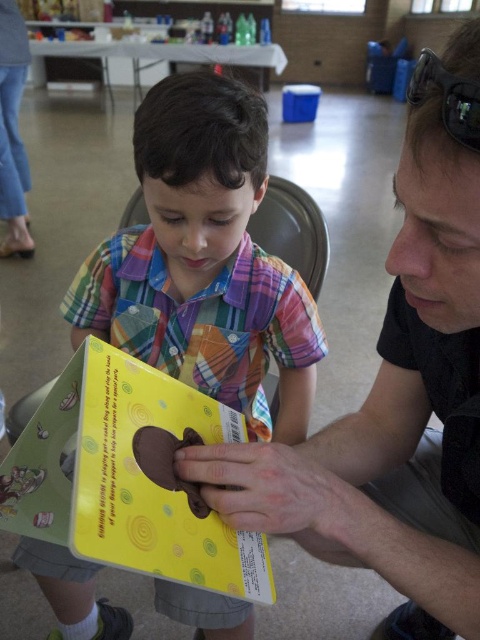
You are a child who wants to reach the yellow matte book at center and the black plastic goggles at upper right. Which object is taller?

The yellow matte book at center is taller than the black plastic goggles at upper right.

You are a delivery robot that needs to place a small package between the yellow matte book at center and the black plastic goggles at upper right. The package is 16 inches long. Can it fit in the space between them?

The distance between the yellow matte book at center and the black plastic goggles at upper right is 17.48 inches. Since the package is 16 inches long, it can fit in the space between them as there is enough room.

Looking at the scene where a child and an adult are interacting with books, which book is positioned to the left between the yellow paper book at center and the yellow matte book at center?

The yellow paper book at center is positioned to the left of the yellow matte book at center.